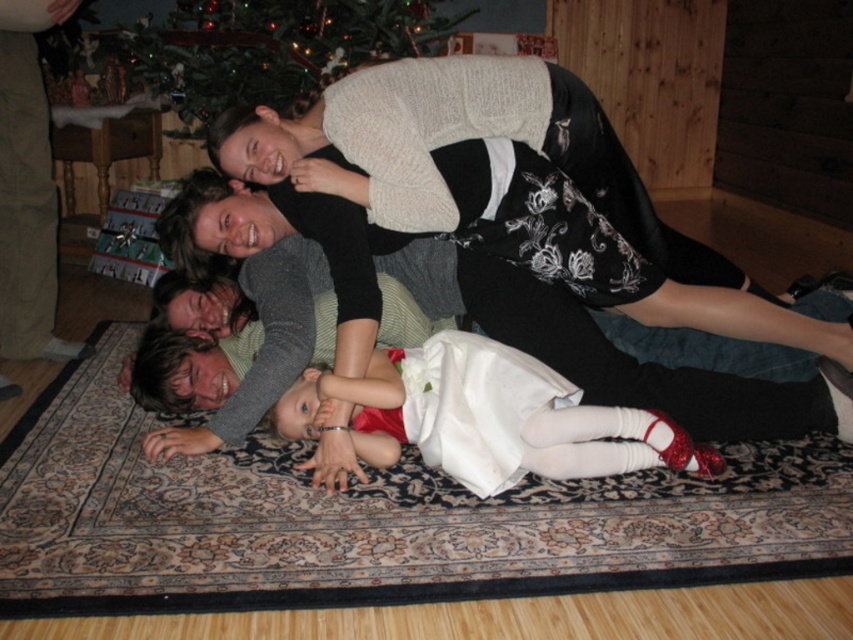
Does white satin dress at center have a lesser width compared to green matte christmas tree at upper center?

Yes, white satin dress at center is thinner than green matte christmas tree at upper center.

Between white satin dress at center and green matte christmas tree at upper center, which one is positioned lower?

white satin dress at center is lower down.

Is point (553, 394) closer to camera compared to point (334, 16)?

Yes, it is in front of point (334, 16).

Identify the location of white satin dress at center. (486, 417).

Who is higher up, black floral dress at upper center or white satin dress at center?

black floral dress at upper center

Who is more distant from viewer, (370, 113) or (430, 460)?

Positioned behind is point (430, 460).

Find the location of `black floral dress at upper center`. black floral dress at upper center is located at coordinates (456, 141).

Which is in front, point (253, 106) or point (325, 84)?

Point (253, 106) is in front.

Between black floral dress at upper center and green matte christmas tree at upper center, which one has more height?

green matte christmas tree at upper center is taller.

Identify the location of black floral dress at upper center. The height and width of the screenshot is (640, 853). (456, 141).